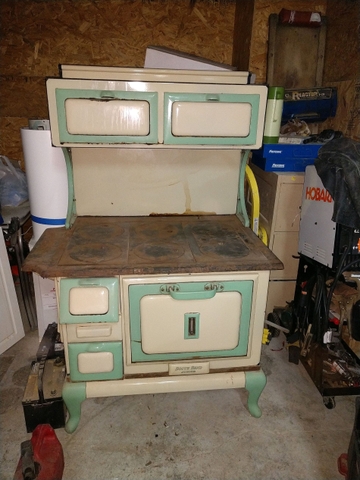
The height and width of the screenshot is (480, 360). Identify the location of plywood. (19, 53).